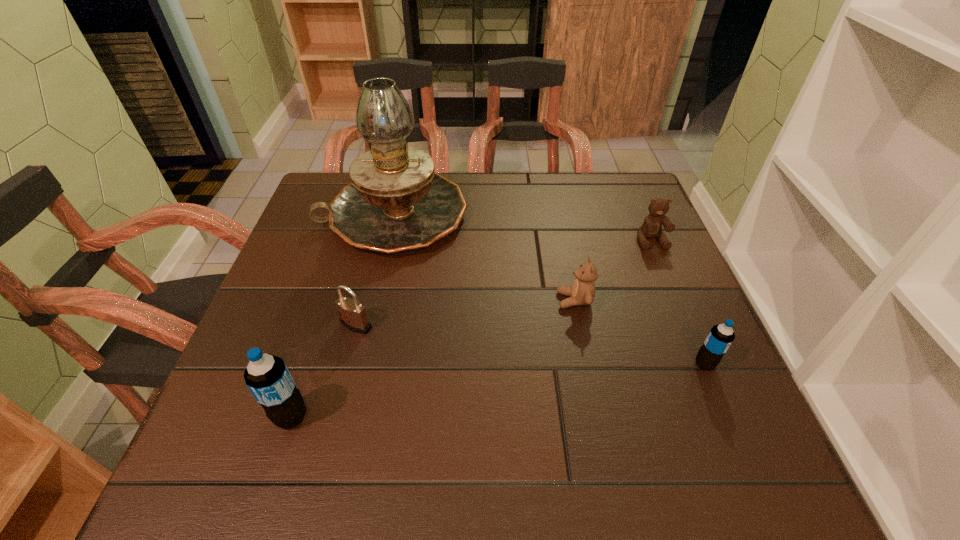
If equal spacing is desired by inserting an extra pop_(soda) among them, please point out a free spot for this new pop_(soda). Please provide its 2D coordinates. Your answer should be formatted as a tuple, i.e. [(x, y)], where the tuple contains the x and y coordinates of a point satisfying the conditions above.

[(508, 389)]